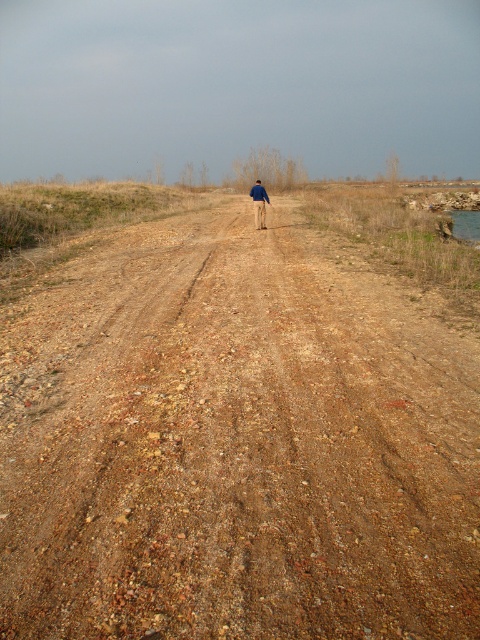
You are standing at the starting point of the dirt road and want to reach the person walking in the distance. Which direction should you head to follow the brown gravel dirt track at center?

You should head towards the direction of the brown gravel dirt track at center, which is located at point [236,442]. Since the person is walking away from the camera towards the horizon, following the dirt track in that direction will lead you towards them.

You are driving a car and see the brown gravel dirt track at center and the blue denim jacket at center in the distance. Which object is closer to you?

The brown gravel dirt track at center is closer to you because it is in front of the blue denim jacket at center.

You are driving a car that is 1.8 meters wide. You come across the brown gravel dirt track at center and see the blue denim jacket at center lying on the road. Can your car safely pass through the track without going off the road?

The brown gravel dirt track at center is wider than the blue denim jacket at center. Since the track is wider than the car which is 1.8 meters wide, the car can safely pass through the track without going off the road.